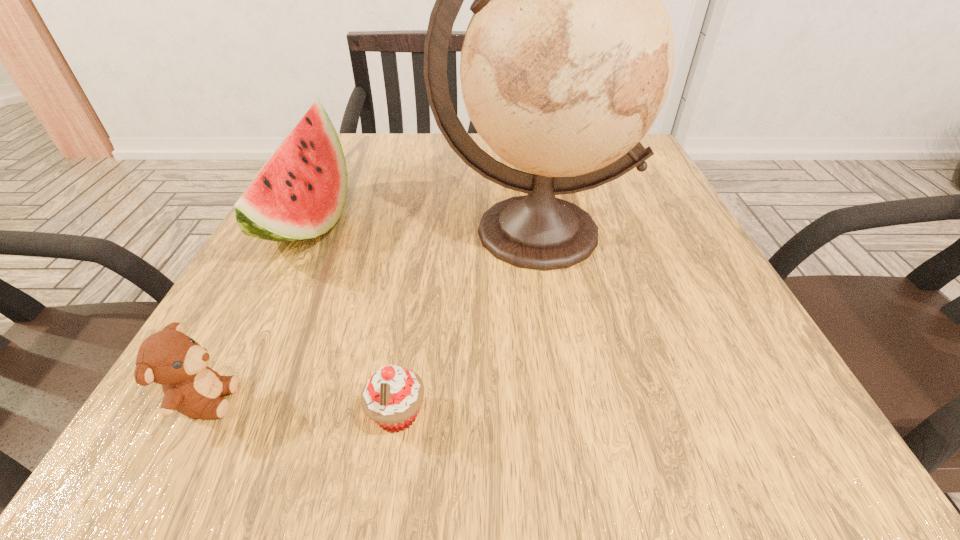
Locate an element on the screen. This screenshot has width=960, height=540. free spot that satisfies the following two spatial constraints: 1. on the front-facing side of the globe; 2. on the face of the teddy bear is located at coordinates (560, 400).

The height and width of the screenshot is (540, 960). I want to click on free location that satisfies the following two spatial constraints: 1. on the back side of the shortest object; 2. on the face of the teddy bear, so click(399, 400).

The width and height of the screenshot is (960, 540). I want to click on free space that satisfies the following two spatial constraints: 1. on the front-facing side of the globe; 2. on the face of the teddy bear, so click(x=560, y=400).